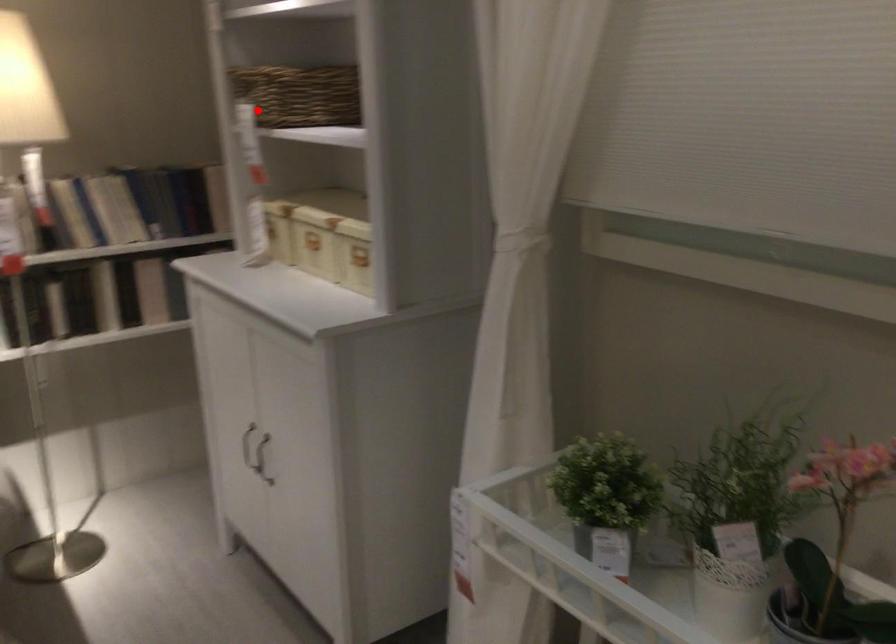
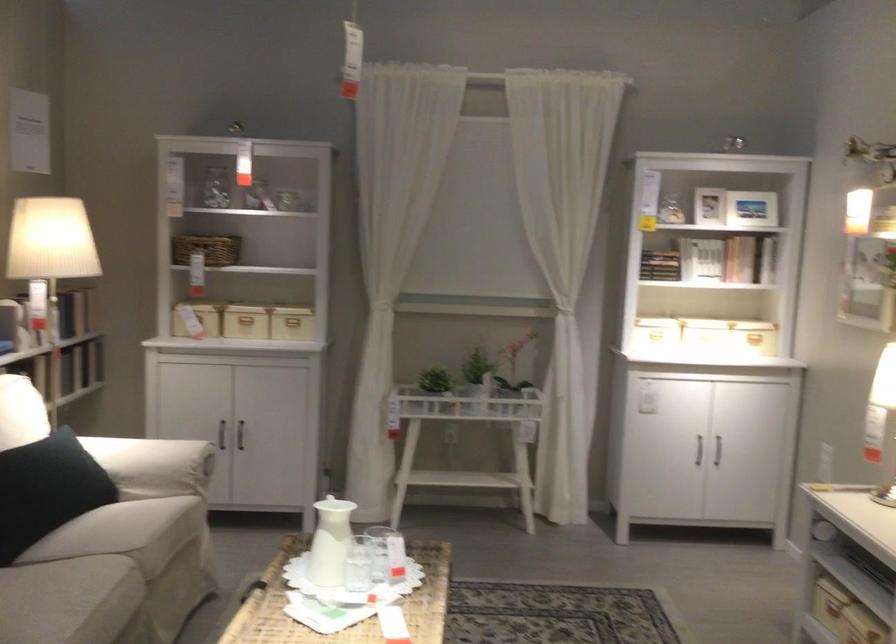
Question: I am providing you with two images of the same scene from different viewpoints. Image1 has a red point marked. In image2, the corresponding 3D location appears at what relative position? Reply with the corresponding letter.

Choices:
 (A) Closer
 (B) Farther

Answer: (B)